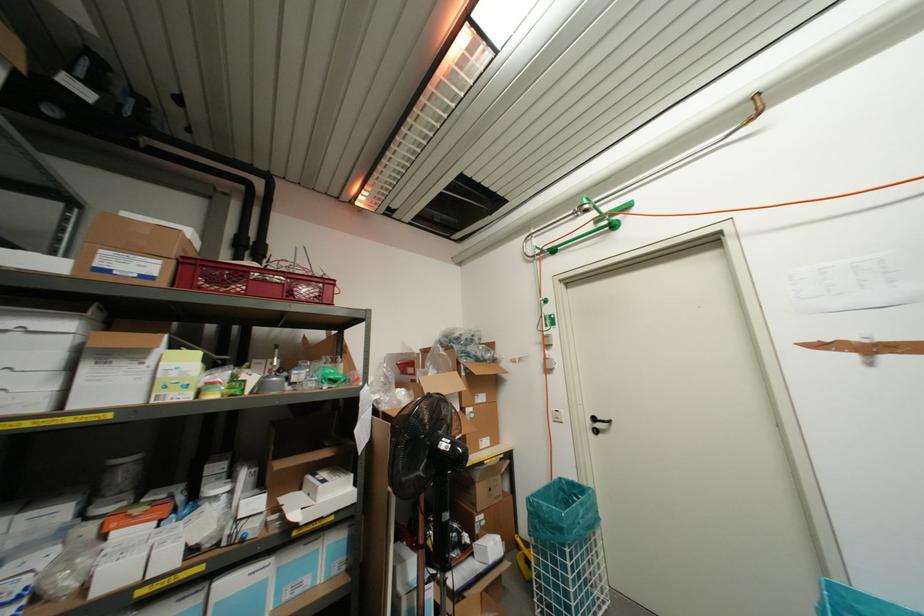
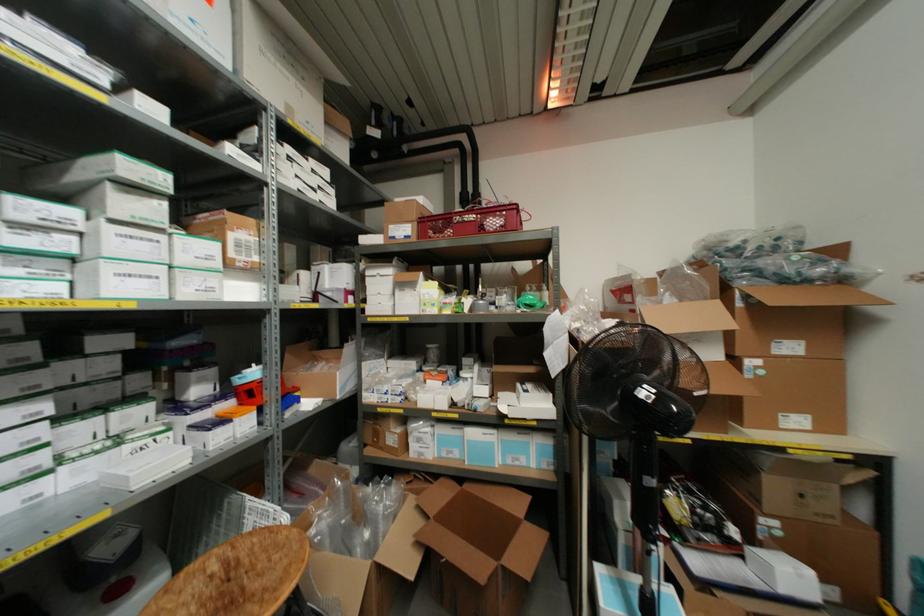
Question: Based on the continuous images, in which direction is the camera rotating? Reply with the corresponding letter.

Choices:
 (A) Left
 (B) Right
 (C) Up
 (D) Down

Answer: (A)